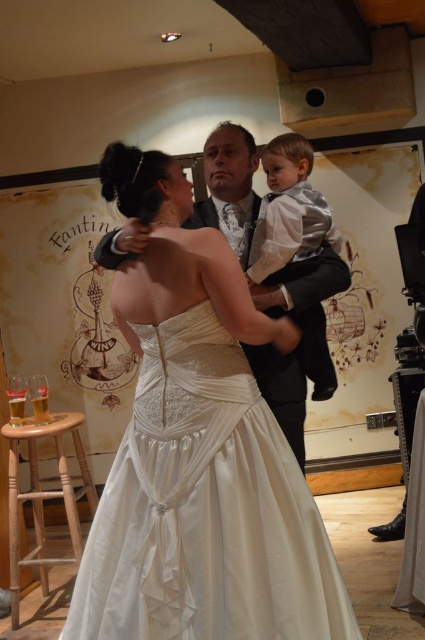
Can you confirm if silver textured suit at center is positioned to the left of light brown wooden stool at lower left?

Incorrect, silver textured suit at center is not on the left side of light brown wooden stool at lower left.

Who is more distant from viewer, (291,172) or (78,545)?

Positioned behind is point (78,545).

The height and width of the screenshot is (640, 425). In order to click on silver textured suit at center in this screenshot , I will do `click(289, 216)`.

Does matte black suit at center have a lesser width compared to light brown wooden stool at lower left?

In fact, matte black suit at center might be wider than light brown wooden stool at lower left.

Which of these two, matte black suit at center or light brown wooden stool at lower left, stands taller?

Standing taller between the two is matte black suit at center.

Is point (320, 296) farther from viewer compared to point (91, 516)?

No.

This screenshot has height=640, width=425. In order to click on matte black suit at center in this screenshot , I will do `click(300, 342)`.

Is the position of satin/smooth wedding dress at center more distant than that of light brown wooden stool at lower left?

That is False.

Locate an element on the screen. This screenshot has width=425, height=640. satin/smooth wedding dress at center is located at coordinates (204, 509).